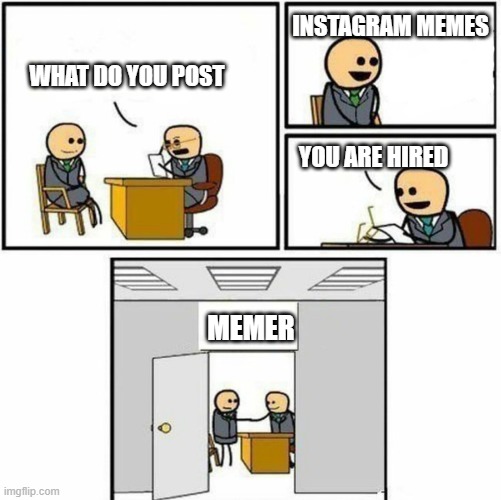
At what (x,y) coordinates should I click in order to perform the action: click on desk. Please return your answer as a coordinate pair (x, y). Looking at the image, I should click on (148, 201), (327, 242), (393, 244), (255, 454).